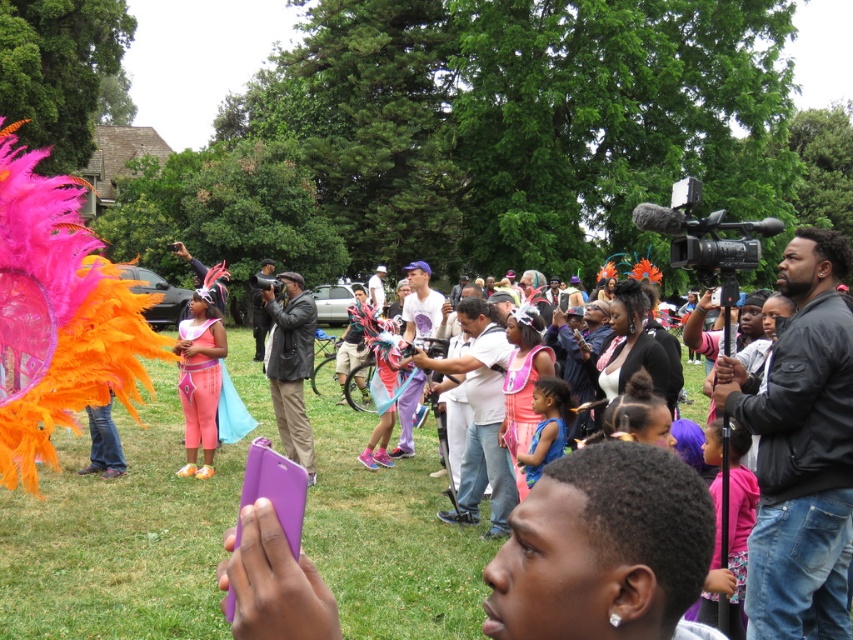
Does black leather jacket at right have a greater width compared to pink fabric dress at center?

Yes.

Consider the image. Does black leather jacket at right have a greater height compared to pink fabric dress at center?

Indeed, black leather jacket at right has a greater height compared to pink fabric dress at center.

This screenshot has height=640, width=853. What do you see at coordinates (801, 449) in the screenshot?
I see `black leather jacket at right` at bounding box center [801, 449].

You are a GUI agent. You are given a task and a screenshot of the screen. Output one action in this format:
    pyautogui.click(x=<x>, y=<y>)
    Task: Click on the black leather jacket at right
    This screenshot has width=853, height=640.
    Given the screenshot: What is the action you would take?
    pyautogui.click(x=801, y=449)

Who is positioned more to the right, pink fabric dress at center or light brown leather jacket at center?

pink fabric dress at center

Does pink fabric dress at center have a greater width compared to light brown leather jacket at center?

No, pink fabric dress at center is not wider than light brown leather jacket at center.

Does point (753, 497) lie in front of point (376, 296)?

That is True.

Image resolution: width=853 pixels, height=640 pixels. Find the location of `pink fabric dress at center`. pink fabric dress at center is located at coordinates (738, 524).

Measure the distance from black leather jacket at right to purple cotton shirt at center.

20.41 feet

Does point (788, 269) come in front of point (404, 406)?

Yes, it is.

Between point (811, 422) and point (401, 420), which one is positioned in front?

Point (811, 422) is in front.

Where is `black leather jacket at right`? black leather jacket at right is located at coordinates (801, 449).